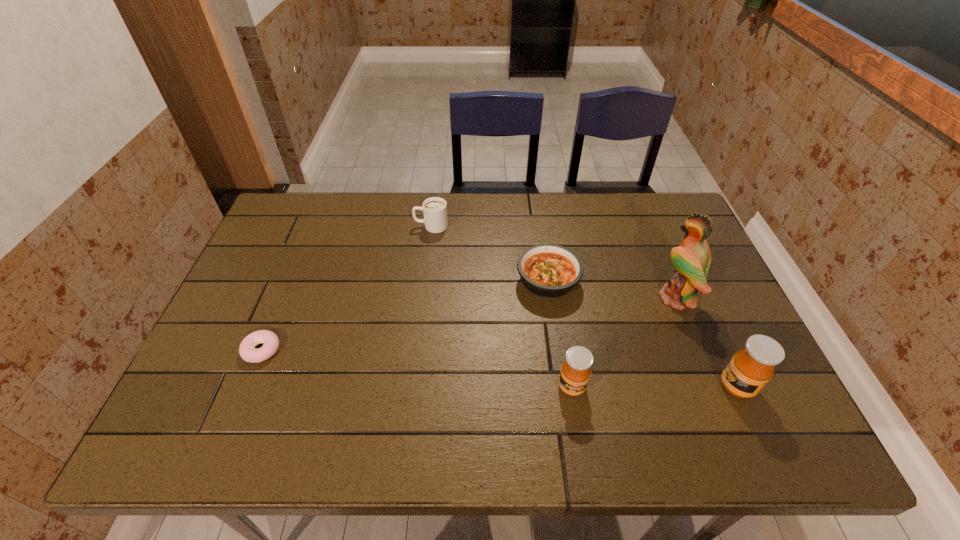
The width and height of the screenshot is (960, 540). In order to click on the fourth shortest object in this screenshot , I will do `click(575, 373)`.

Locate an element on the screen. the left honey is located at coordinates (575, 373).

Where is `the right honey`? The height and width of the screenshot is (540, 960). the right honey is located at coordinates (750, 369).

I want to click on the fifth shortest object, so click(x=750, y=369).

Locate an element on the screen. The height and width of the screenshot is (540, 960). the fifth object from right to left is located at coordinates (434, 209).

Find the location of a particular element. The height and width of the screenshot is (540, 960). cappuccino is located at coordinates (434, 209).

Where is `parrot`? This screenshot has height=540, width=960. parrot is located at coordinates (692, 259).

Locate an element on the screen. The image size is (960, 540). the fourth farthest object is located at coordinates (247, 351).

The image size is (960, 540). Identify the location of the shortest object. (247, 351).

This screenshot has width=960, height=540. In order to click on the fifth tallest object in this screenshot , I will do `click(549, 271)`.